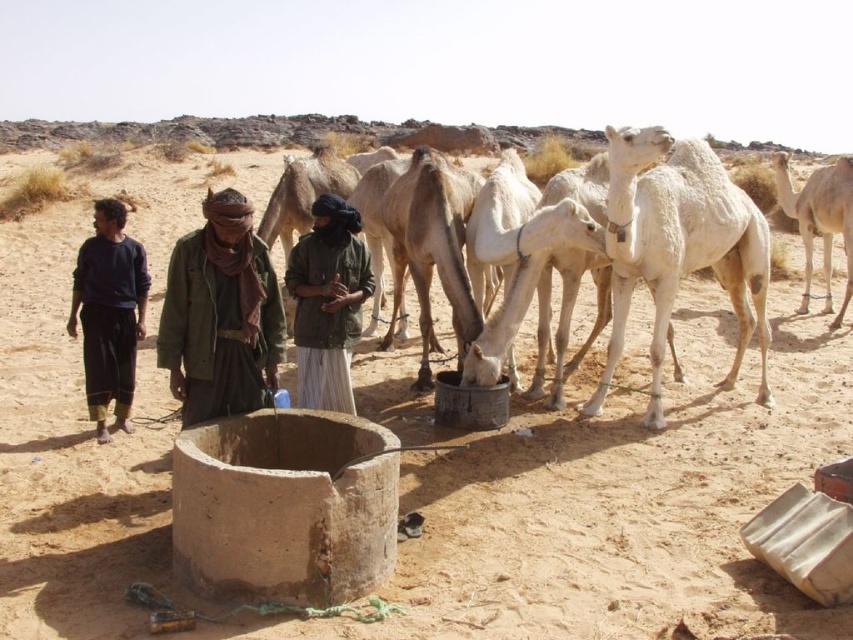
Question: Considering the relative positions of green fabric headscarf at center and white matte camel at right in the image provided, where is green fabric headscarf at center located with respect to white matte camel at right?

Choices:
 (A) right
 (B) left

Answer: (B)

Question: Which point is farther to the camera?

Choices:
 (A) green fabric headscarf at center
 (B) white matte camel at right
 (C) brown fabric headscarf at center

Answer: (B)

Question: Is green fabric headscarf at center thinner than dark blue fabric pants at left?

Choices:
 (A) no
 (B) yes

Answer: (B)

Question: Does brown fabric headscarf at center appear on the left side of green fabric headscarf at center?

Choices:
 (A) yes
 (B) no

Answer: (A)

Question: Among these objects, which one is farthest from the camera?

Choices:
 (A) white matte camel at right
 (B) dark blue fabric pants at left

Answer: (A)

Question: Which point is farther to the camera?

Choices:
 (A) (840, 179)
 (B) (248, 332)
 (C) (103, 275)
 (D) (317, 221)

Answer: (A)